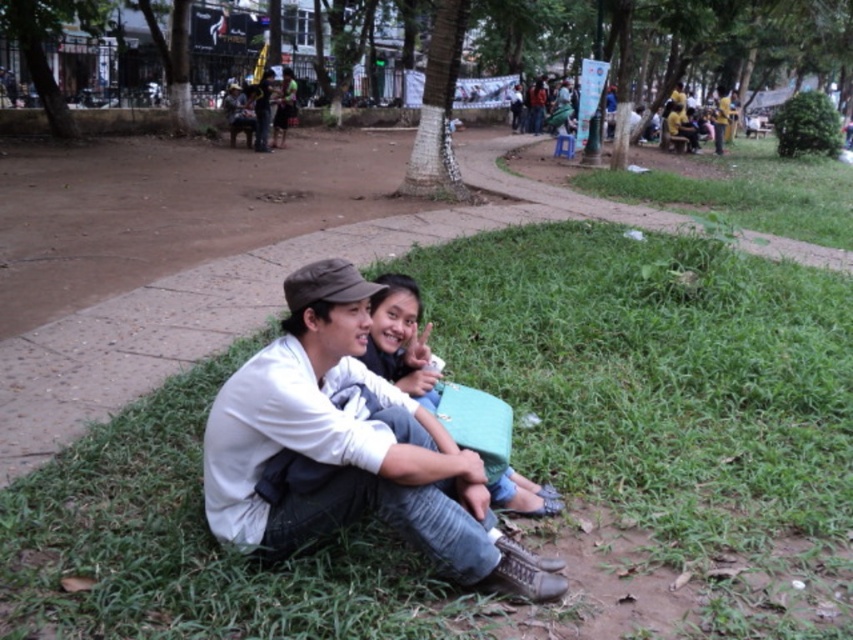
Question: Among these objects, which one is farthest from the camera?

Choices:
 (A) white matte shirt at center
 (B) matte green bag at center

Answer: (B)

Question: Does green grass at lower center lie in front of matte green bag at center?

Choices:
 (A) no
 (B) yes

Answer: (A)

Question: Estimate the real-world distances between objects in this image. Which object is farther from the matte green bag at center?

Choices:
 (A) white matte shirt at center
 (B) green grass at lower center

Answer: (B)

Question: Does green grass at lower center appear on the left side of matte green bag at center?

Choices:
 (A) yes
 (B) no

Answer: (B)

Question: Can you confirm if white matte shirt at center is positioned below matte green bag at center?

Choices:
 (A) no
 (B) yes

Answer: (B)

Question: Which of the following is the farthest from the observer?

Choices:
 (A) (508, 500)
 (B) (747, 403)

Answer: (B)